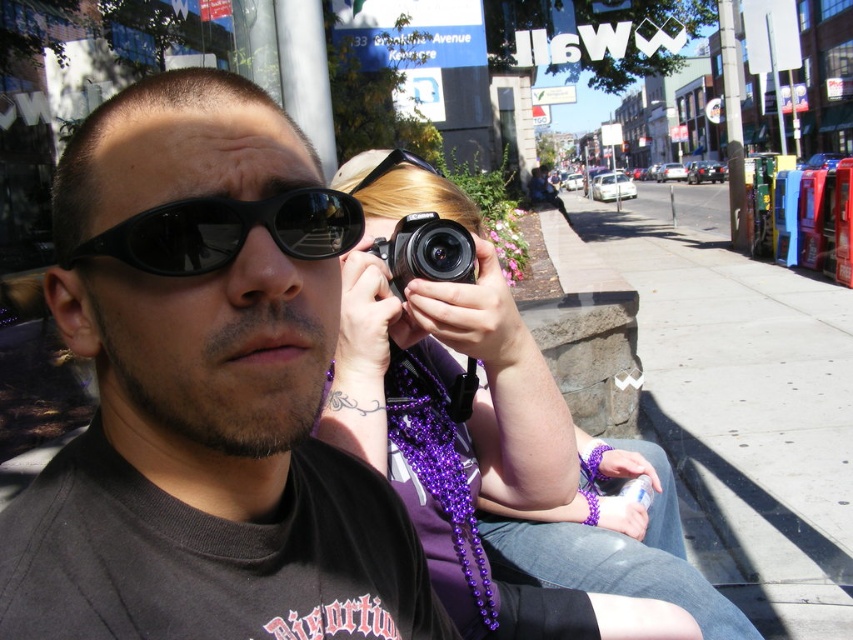
Question: Can you confirm if black reflective sunglasses at center is wider than black plastic camera at center?

Choices:
 (A) yes
 (B) no

Answer: (A)

Question: Considering the real-world distances, which object is farthest from the matte black sunglasses at center?

Choices:
 (A) black plastic camera at center
 (B) black reflective sunglasses at center
 (C) purple beaded necklace at center

Answer: (A)

Question: Is black reflective sunglasses at center above black plastic camera at center?

Choices:
 (A) no
 (B) yes

Answer: (A)

Question: Which of the following is the closest to the observer?

Choices:
 (A) purple beaded necklace at center
 (B) matte black sunglasses at center

Answer: (B)

Question: Where is purple beaded necklace at center located in relation to black reflective sunglasses at center in the image?

Choices:
 (A) left
 (B) right

Answer: (B)

Question: Which point is closer to the camera?

Choices:
 (A) (479, 620)
 (B) (338, 211)
 (C) (6, 600)

Answer: (C)